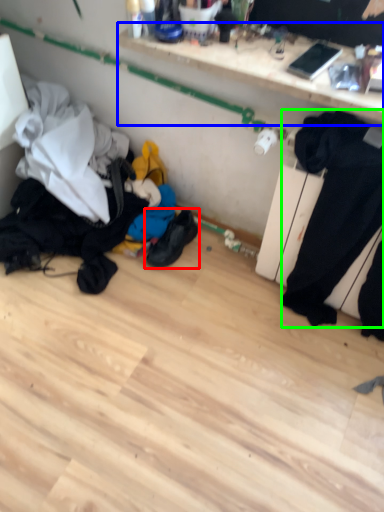
Question: Which object is the farthest from footwear (highlighted by a red box)? Choose among these: shelf (highlighted by a blue box) or sweat pant (highlighted by a green box).

Choices:
 (A) shelf
 (B) sweat pant

Answer: (A)